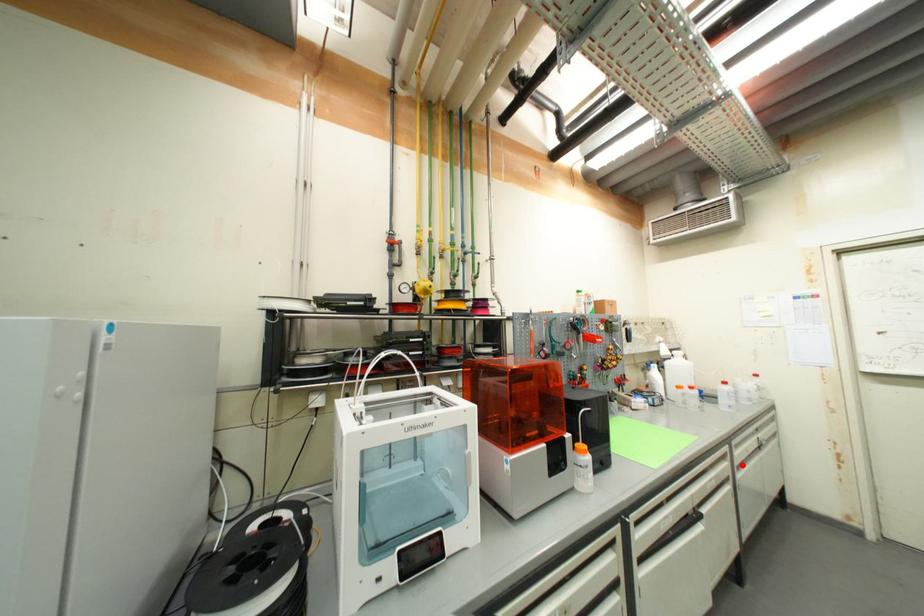
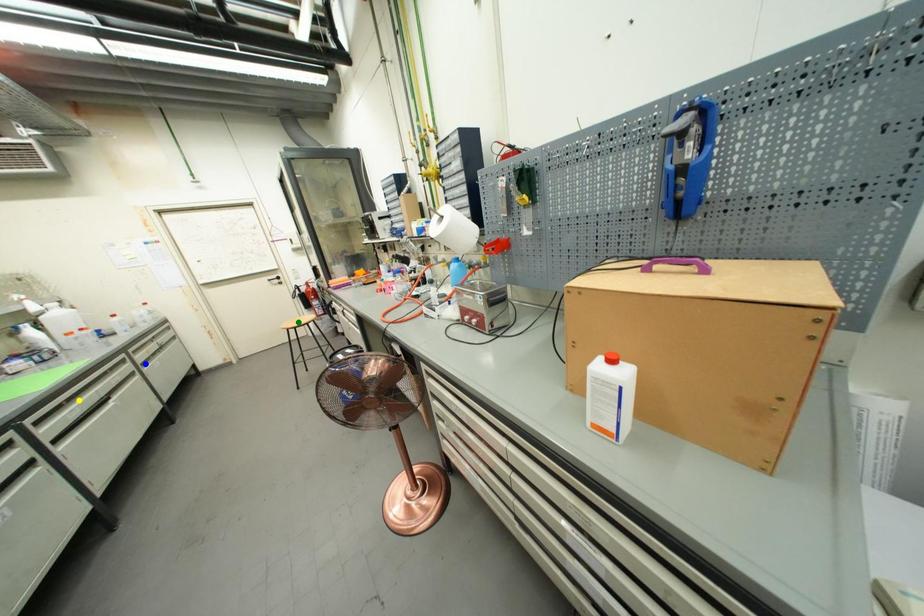
Question: I am providing you with two images of the same scene from different viewpoints. A red point is marked on the first image. You are given multiple points on the second image. Which point in image 2 is actually the same real-world point as the red point in image 1?

Choices:
 (A) blue point
 (B) yellow point
 (C) green point

Answer: (A)